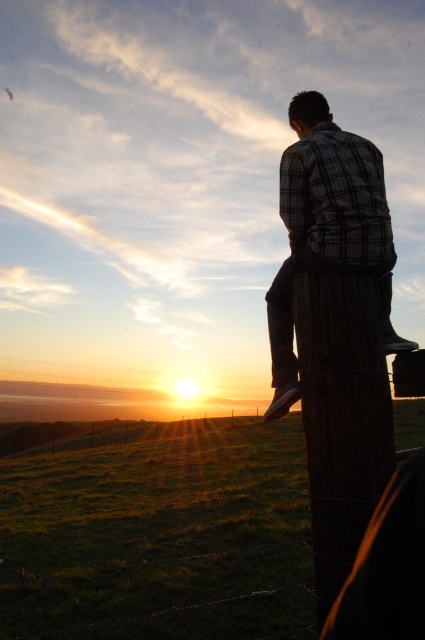
Question: Does dark brown wooden post at right appear on the right side of plaid fabric shirt at center?

Choices:
 (A) yes
 (B) no

Answer: (A)

Question: Which point is farther to the camera?

Choices:
 (A) dark brown wooden post at right
 (B) plaid fabric shirt at center

Answer: (B)

Question: Is dark brown wooden post at right positioned before plaid fabric shirt at center?

Choices:
 (A) yes
 (B) no

Answer: (A)

Question: Which point is closer to the camera?

Choices:
 (A) (278, 413)
 (B) (345, 365)

Answer: (B)

Question: Can you confirm if dark brown wooden post at right is positioned to the right of plaid fabric shirt at center?

Choices:
 (A) yes
 (B) no

Answer: (A)